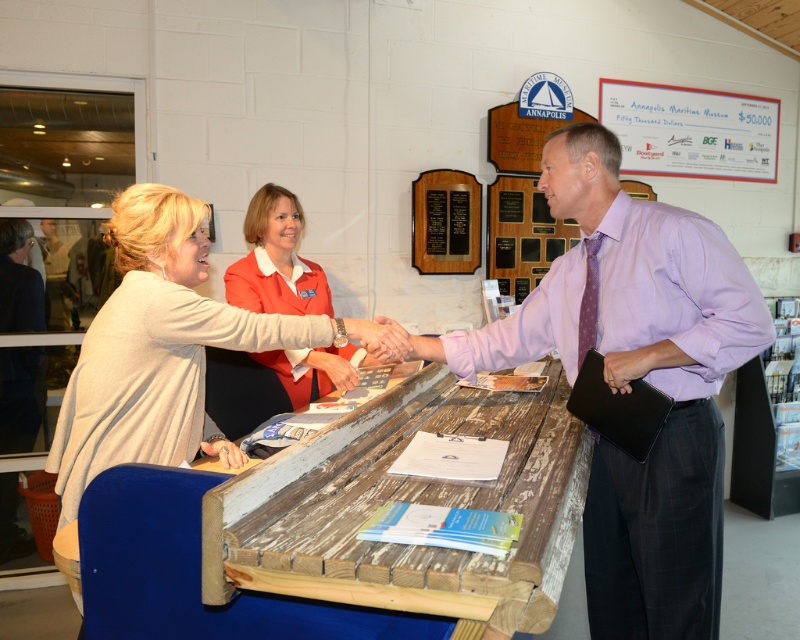
Question: Which point appears closest to the camera in this image?

Choices:
 (A) (713, 541)
 (B) (150, 428)

Answer: (B)

Question: Can you confirm if weathered wood table at center is thinner than light beige sweater at center?

Choices:
 (A) no
 (B) yes

Answer: (A)

Question: Can you confirm if weathered wood table at center is bigger than light beige sweater at center?

Choices:
 (A) yes
 (B) no

Answer: (A)

Question: Which object is closer to the camera taking this photo?

Choices:
 (A) purple shirt at center
 (B) light beige sweater at center

Answer: (B)

Question: Which of the following is the farthest from the observer?

Choices:
 (A) light beige sweater at center
 (B) purple shirt at center
 (C) weathered wood table at center

Answer: (B)

Question: Is purple shirt at center to the right of light beige sweater at center from the viewer's perspective?

Choices:
 (A) no
 (B) yes

Answer: (B)